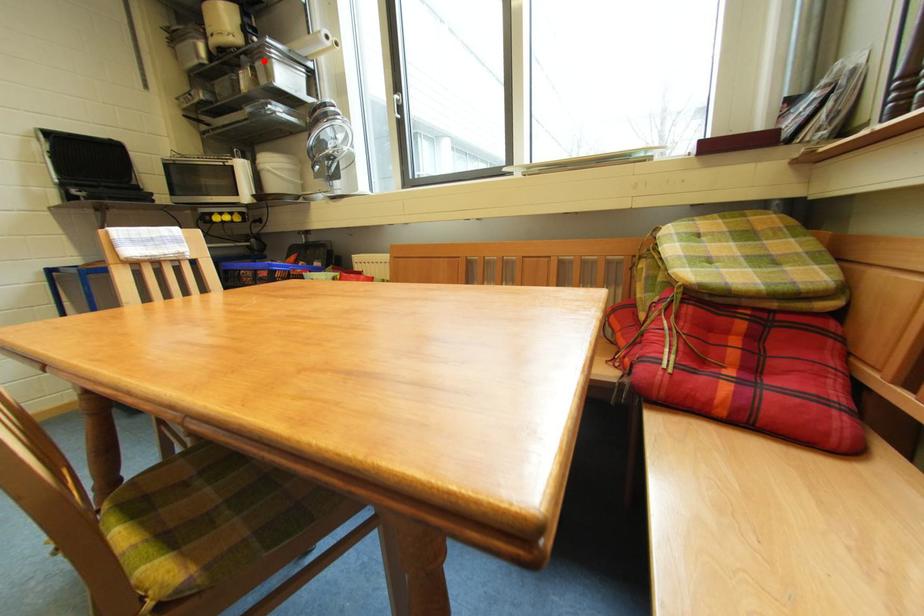
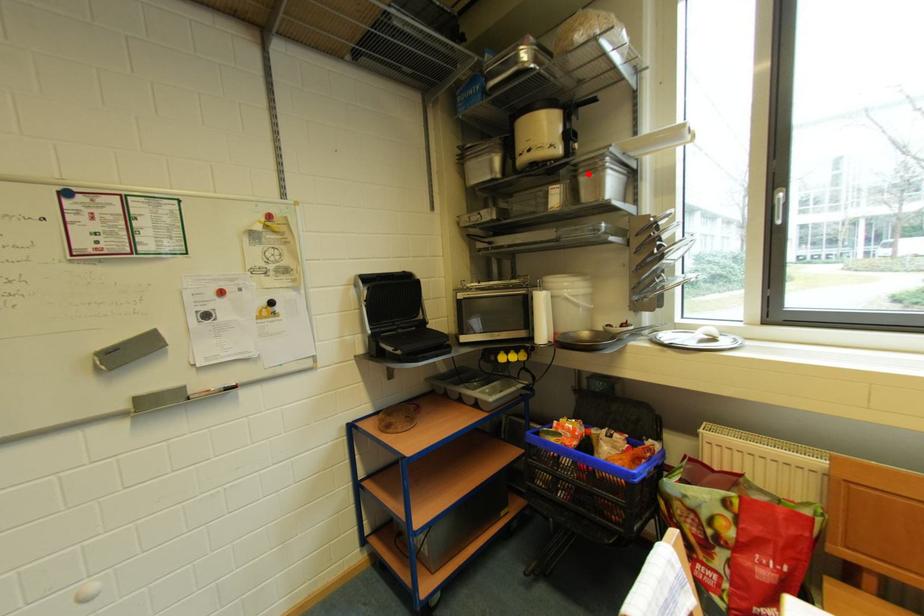
I am providing you with two images of the same scene from different viewpoints. A red point is marked on the first image and another point is marked on the second image. Are the points marked in image1 and image2 representing the same 3D position?

Yes